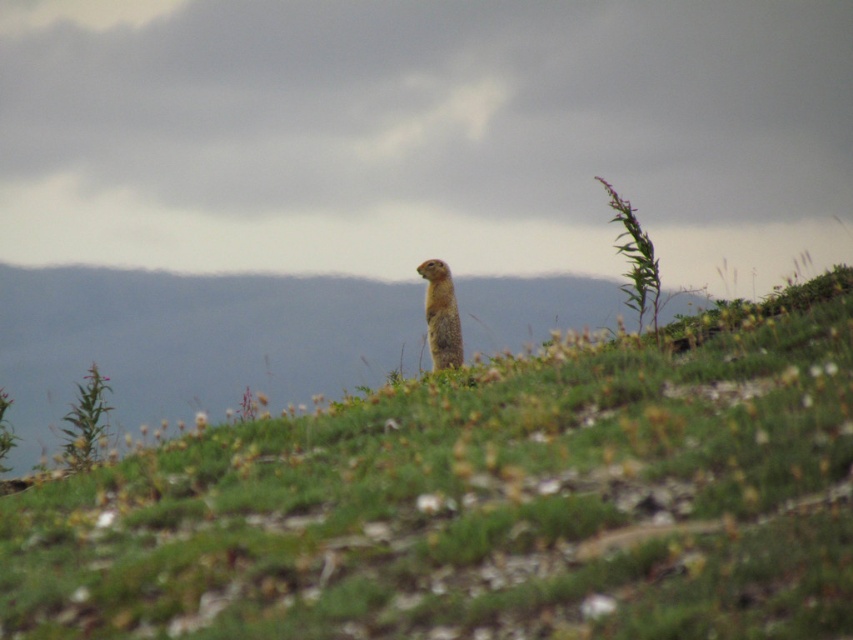
The image size is (853, 640). In order to click on green grassy at center in this screenshot , I will do `click(483, 500)`.